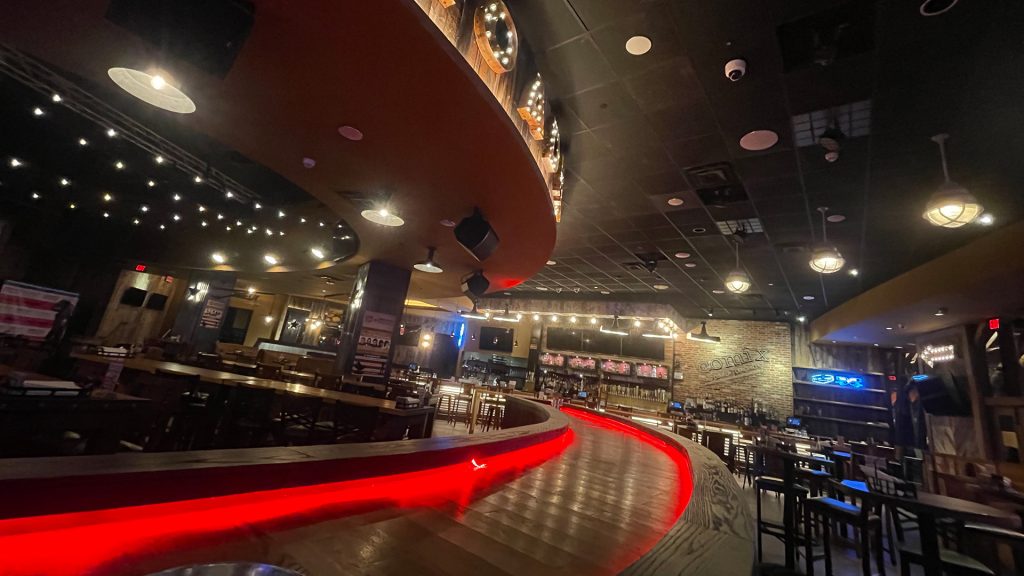
This screenshot has width=1024, height=576. What are the coordinates of `chair` in the screenshot? It's located at (797, 539).